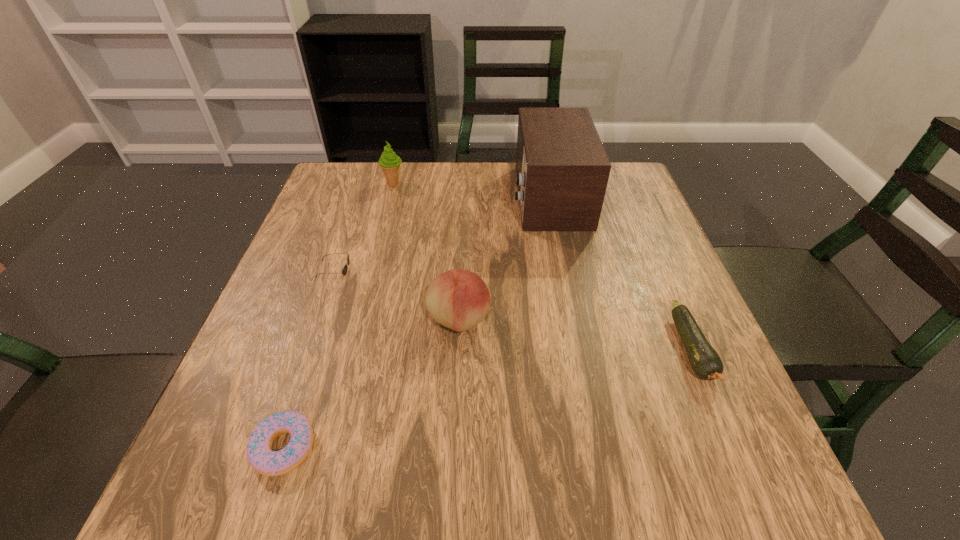
At what (x,y) coordinates should I click in order to perform the action: click on free space between the peach and the zucchini. Please return your answer as a coordinate pair (x, y). This screenshot has height=540, width=960. Looking at the image, I should click on (575, 335).

Where is `free space between the icecream and the nearest object`? Image resolution: width=960 pixels, height=540 pixels. free space between the icecream and the nearest object is located at coordinates (339, 315).

You are a GUI agent. You are given a task and a screenshot of the screen. Output one action in this format:
    pyautogui.click(x=<x>, y=<y>)
    Task: Click on the vacant space in between the zucchini and the doughnut
    
    Given the screenshot: What is the action you would take?
    pyautogui.click(x=489, y=399)

Where is `vacant space that's between the doughnut and the tallest object`? The height and width of the screenshot is (540, 960). vacant space that's between the doughnut and the tallest object is located at coordinates (417, 322).

This screenshot has width=960, height=540. Find the location of `free area in between the tallest object and the fifth shortest object`. free area in between the tallest object and the fifth shortest object is located at coordinates (471, 190).

Find the location of a particular element. The height and width of the screenshot is (540, 960). unoccupied position between the fourth tallest object and the icecream is located at coordinates (366, 233).

Locate which object ranks second in proximity to the sunglasses. Please provide its 2D coordinates. Your answer should be formatted as a tuple, i.e. [(x, y)], where the tuple contains the x and y coordinates of a point satisfying the conditions above.

[(259, 452)]

Identify the location of the closest object to the third tallest object. The width and height of the screenshot is (960, 540). (344, 271).

Find the location of a particular element. This screenshot has width=960, height=540. free region that satisfies the following two spatial constraints: 1. on the front-facing side of the tallest object; 2. on the front side of the peach is located at coordinates (573, 320).

Identify the location of vacant space that satisfies the following two spatial constraints: 1. in front of the lenses of the sunglasses; 2. on the back side of the fourth object from left to right. The width and height of the screenshot is (960, 540). (325, 320).